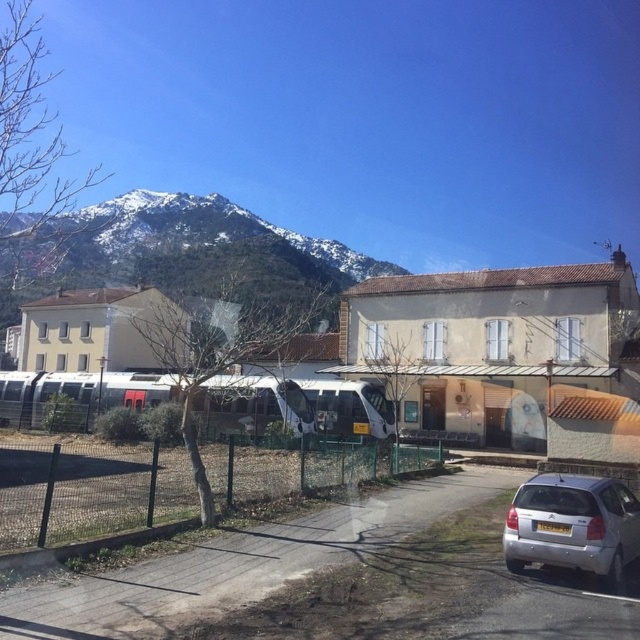
Question: Which of the following is the farthest from the observer?

Choices:
 (A) (90, 464)
 (B) (531, 480)
 (C) (26, 401)
 (D) (364, 268)

Answer: (D)

Question: Which of the following is the closest to the observer?

Choices:
 (A) (80, 413)
 (B) (522, 532)
 (C) (230, 212)
 (D) (72, 483)

Answer: (B)

Question: Is green wire mesh fence at center wider than silver metallic hatchback at lower right?

Choices:
 (A) yes
 (B) no

Answer: (A)

Question: Which object is positioned closest to the snowy rock mountain at upper left?

Choices:
 (A) silver metallic hatchback at lower right
 (B) green wire mesh fence at center
 (C) white glossy passenger train at center

Answer: (C)

Question: Is green wire mesh fence at center to the right of snowy rock mountain at upper left from the viewer's perspective?

Choices:
 (A) yes
 (B) no

Answer: (A)

Question: Does snowy rock mountain at upper left appear under white glossy passenger train at center?

Choices:
 (A) yes
 (B) no

Answer: (B)